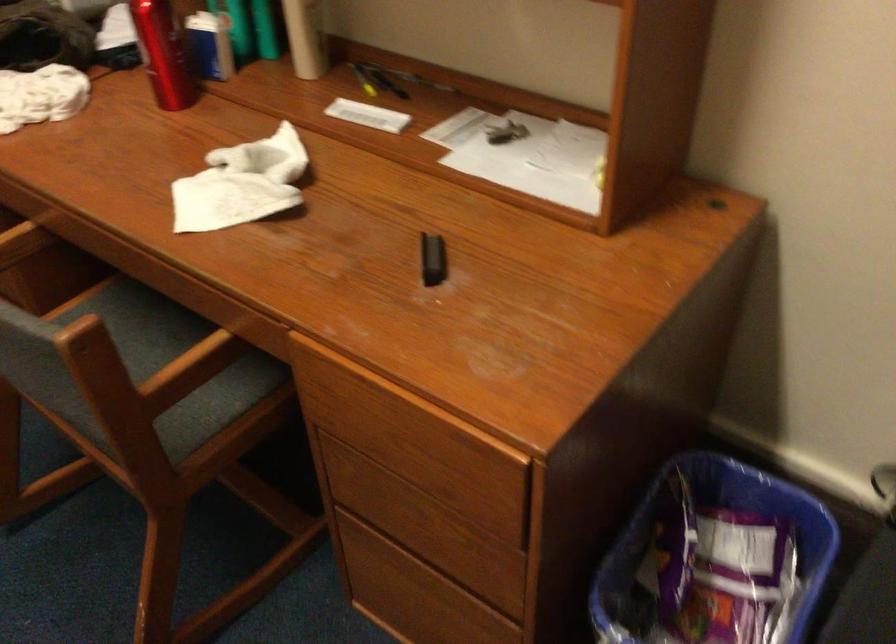
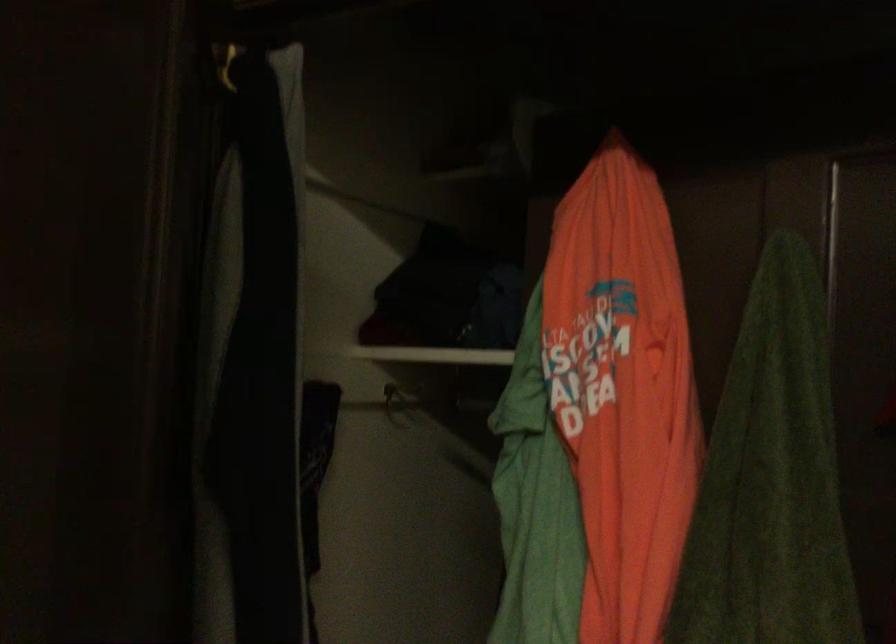
Question: The first image is from the beginning of the video and the second image is from the end. How did the camera likely rotate when shooting the video?

Choices:
 (A) Left
 (B) Right
 (C) Up
 (D) Down

Answer: (B)